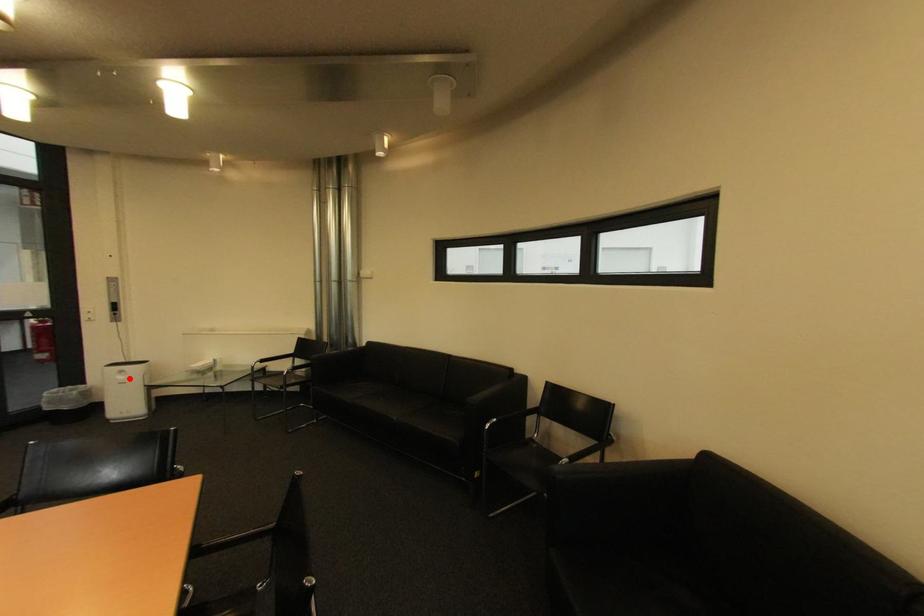
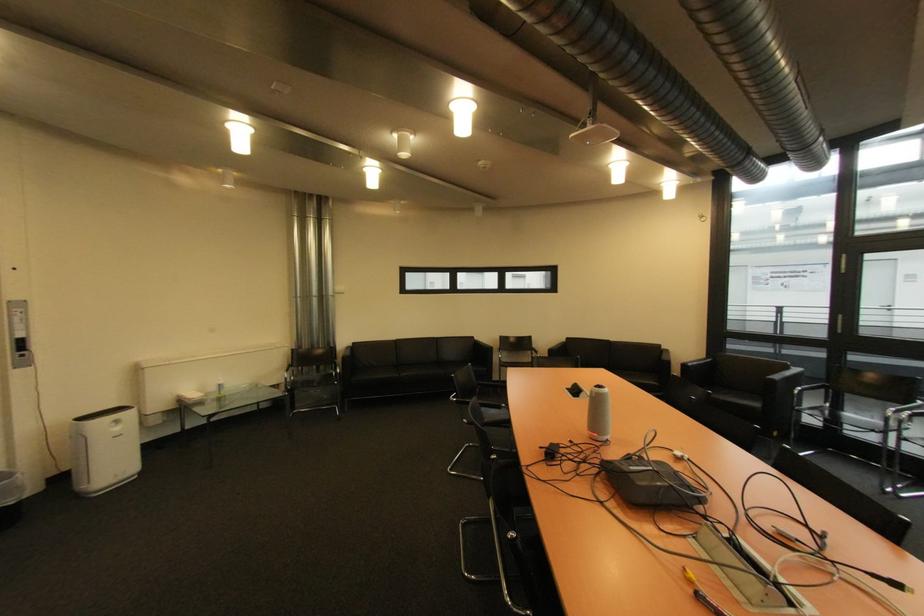
Question: A red point is marked in image1. In image2, is the corresponding 3D point closer to the camera or farther? Reply with the corresponding letter.

Choices:
 (A) The corresponding 3D point is closer.
 (B) The corresponding 3D point is farther.

Answer: (B)